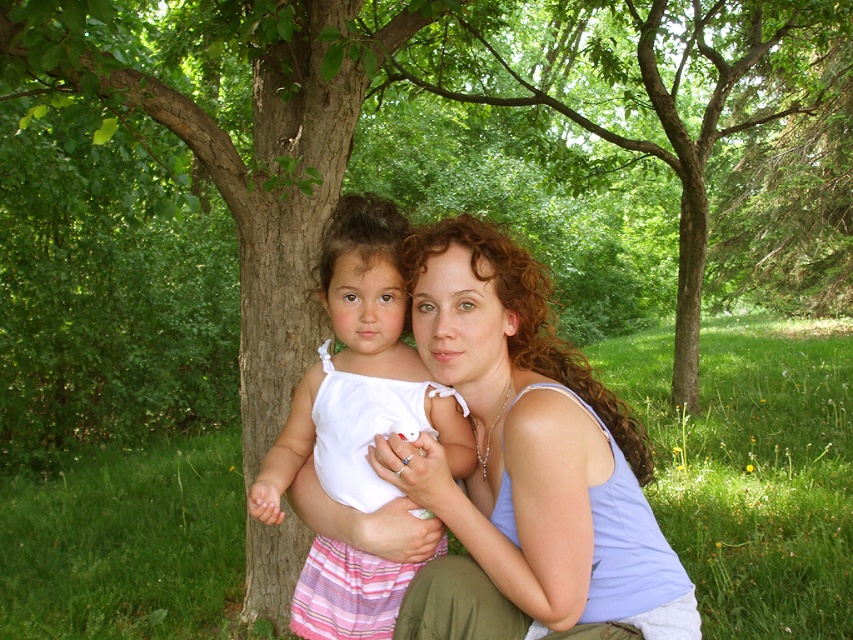
Please look at the image. There is a point marked at coordinates (523,460). What object does this point correspond to?

The point at coordinates (523,460) corresponds to the light blue tank top at center.

You are standing in the park and want to take a photo of the green leafy tree at center. If your camera can focus on objects up to 10 feet away, will it be able to capture the tree clearly?

The green leafy tree at center is 9.33 feet away from the camera, which is within the camera focus range of up to 10 feet. Therefore, the camera can capture the tree clearly.